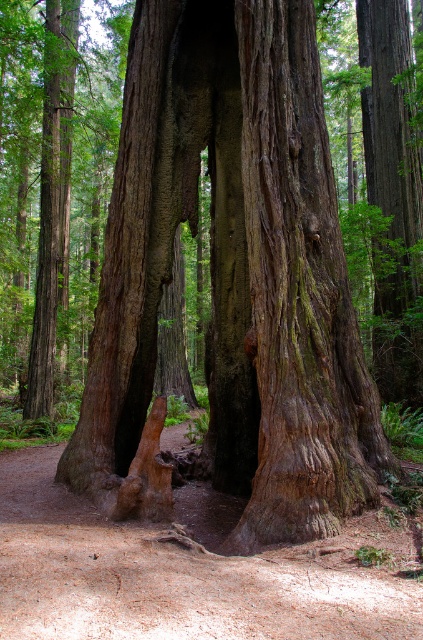
You are a hiker trying to determine which tree trunk to climb between the green mossy bark tree trunk at center and the smooth brown bark at center. Based on their widths, which tree trunk would be more stable for climbing?

The green mossy bark tree trunk at center has a larger width than the smooth brown bark at center, making it more stable for climbing.

You are a hiker trying to find the path through the forest. You see a brown dirt trail at center and a smooth brown bark at center. Which one is narrower?

The brown dirt trail at center is smaller than smooth brown bark at center, so the brown dirt trail at center is narrower.

You are a hiker trying to determine the best path through the forest. You notice a green mossy bark tree trunk at center and a brown dirt trail at center. Which object is taller?

The green mossy bark tree trunk at center is taller than the brown dirt trail at center.